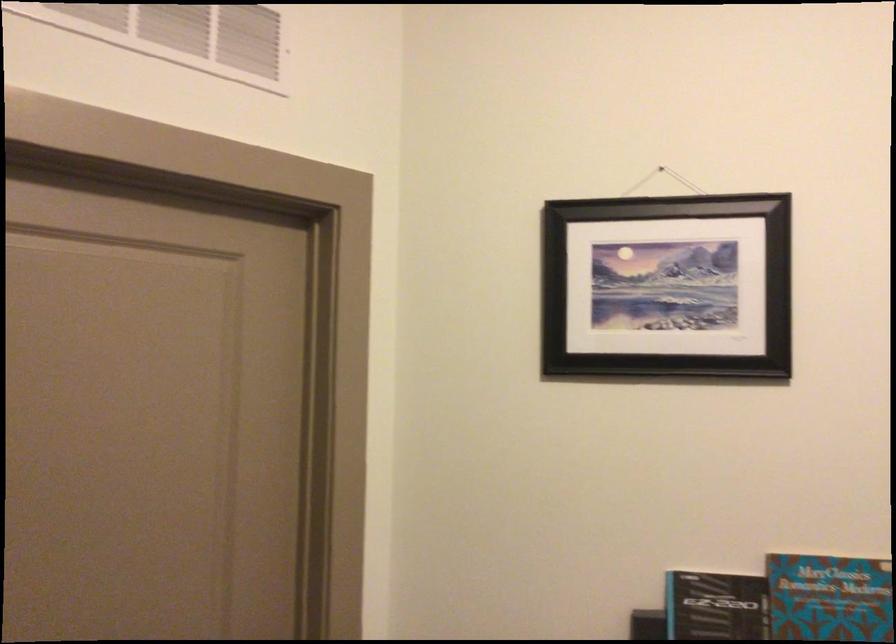
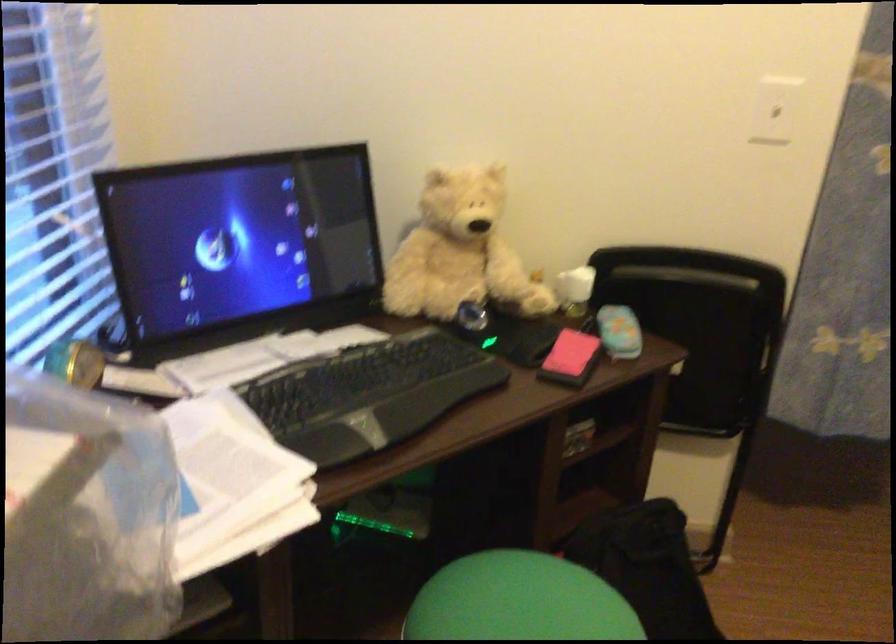
First-person continuous shooting, in which direction is the camera rotating?

The camera's rotation is toward right-down.